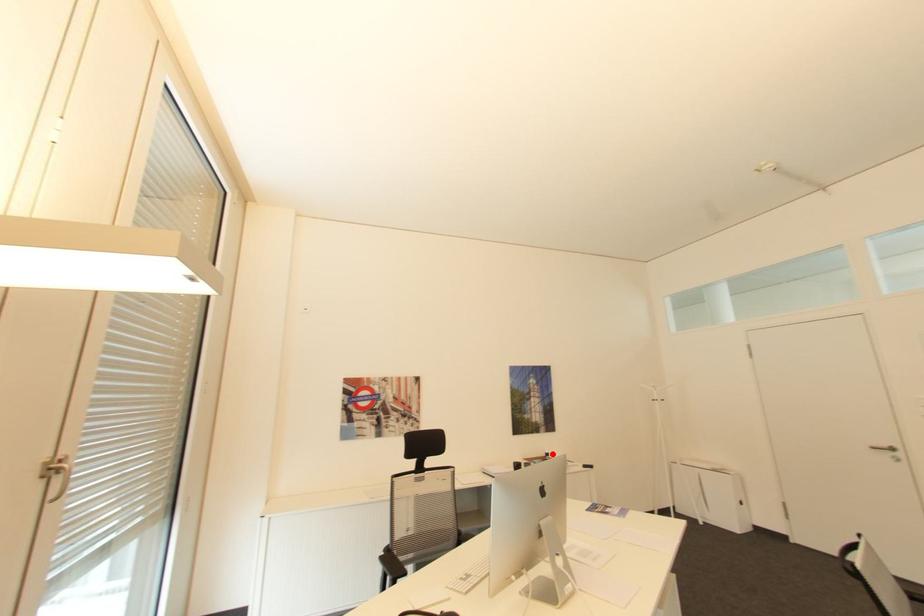
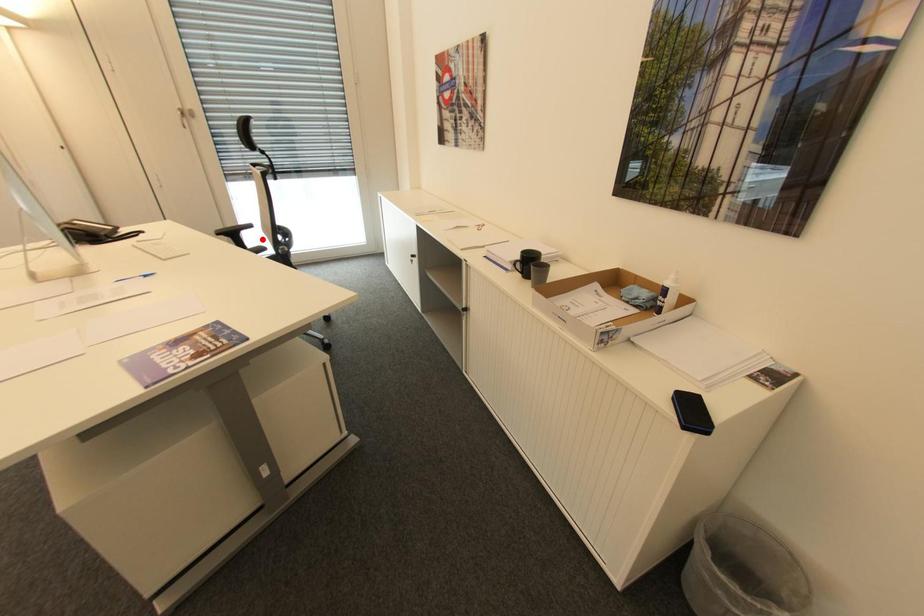
I am providing you with two images of the same scene from different viewpoints. A red point is marked on the first image and another point is marked on the second image. Is the marked point in image1 the same physical position as the marked point in image2?

No